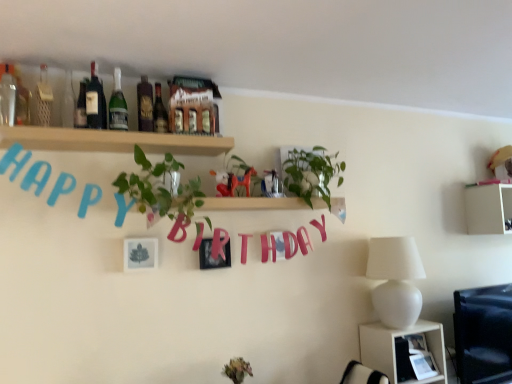
Question: From a real-world perspective, is green glass bottle at upper center, which is counted as the 5th bottle, starting from the left, located higher than white matte lamp at right?

Choices:
 (A) no
 (B) yes

Answer: (B)

Question: Is green glass bottle at upper center, which appears as the third bottle when viewed from the right, with white matte lamp at right?

Choices:
 (A) no
 (B) yes

Answer: (A)

Question: Is green glass bottle at upper center, which appears as the third bottle when viewed from the right, completely or partially outside of white matte lamp at right?

Choices:
 (A) yes
 (B) no

Answer: (A)

Question: Is green glass bottle at upper center, which appears as the third bottle when viewed from the right, facing away from white matte lamp at right?

Choices:
 (A) yes
 (B) no

Answer: (B)

Question: Considering the relative sizes of green glass bottle at upper center, which appears as the third bottle when viewed from the right, and white matte lamp at right in the image provided, is green glass bottle at upper center, which appears as the third bottle when viewed from the right, shorter than white matte lamp at right?

Choices:
 (A) no
 (B) yes

Answer: (B)

Question: Considering their positions, is green glass bottle at upper center, which is counted as the 5th bottle, starting from the left, located in front of or behind green leafy plant at center?

Choices:
 (A) behind
 (B) front

Answer: (A)

Question: From a real-world perspective, relative to green leafy plant at center, is green glass bottle at upper center, which appears as the third bottle when viewed from the right, vertically above or below?

Choices:
 (A) above
 (B) below

Answer: (A)

Question: Considering the positions of point (112, 104) and point (139, 206), is point (112, 104) closer or farther from the camera than point (139, 206)?

Choices:
 (A) closer
 (B) farther

Answer: (B)

Question: Is green glass bottle at upper center, which is counted as the 5th bottle, starting from the left, bigger or smaller than green leafy plant at center?

Choices:
 (A) small
 (B) big

Answer: (A)

Question: Is matte glass bottle at upper left, marked as the first bottle in a left-to-right arrangement, situated inside metallic silver picture frame at center, which is the 1th picture frame in left-to-right order, or outside?

Choices:
 (A) inside
 (B) outside

Answer: (B)

Question: In the image, is matte glass bottle at upper left, the 7th bottle in the right-to-left sequence, on the left side or the right side of metallic silver picture frame at center, which is the 1th picture frame in left-to-right order?

Choices:
 (A) right
 (B) left

Answer: (B)

Question: From the image's perspective, relative to metallic silver picture frame at center, the 2th picture frame viewed from the right, is matte glass bottle at upper left, marked as the first bottle in a left-to-right arrangement, above or below?

Choices:
 (A) below
 (B) above

Answer: (B)

Question: Is point (8, 81) closer or farther from the camera than point (126, 251)?

Choices:
 (A) farther
 (B) closer

Answer: (B)

Question: From the image's perspective, is matte red horse at center located above or below green leafy plant at center?

Choices:
 (A) below
 (B) above

Answer: (B)

Question: Is matte red horse at center inside the boundaries of green leafy plant at center, or outside?

Choices:
 (A) inside
 (B) outside

Answer: (B)